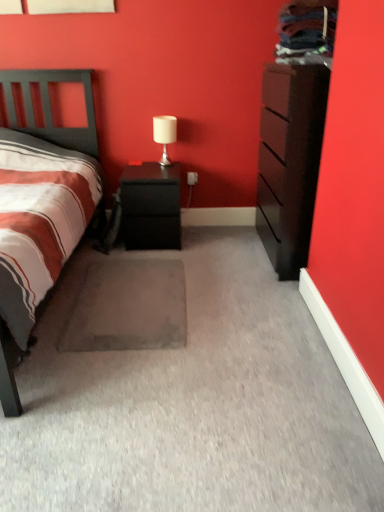
Question: Should I look upward or downward to see black matte nightstand at center?

Choices:
 (A) up
 (B) down

Answer: (A)

Question: From a real-world perspective, is black matte nightstand at center located beneath dark brown wood chest of drawers at right?

Choices:
 (A) yes
 (B) no

Answer: (A)

Question: Considering the relative sizes of black matte nightstand at center and dark brown wood chest of drawers at right in the image provided, is black matte nightstand at center bigger than dark brown wood chest of drawers at right?

Choices:
 (A) yes
 (B) no

Answer: (B)

Question: Is black matte nightstand at center looking in the opposite direction of dark brown wood chest of drawers at right?

Choices:
 (A) yes
 (B) no

Answer: (B)

Question: Is black matte nightstand at center in contact with dark brown wood chest of drawers at right?

Choices:
 (A) no
 (B) yes

Answer: (A)

Question: Is black matte nightstand at center oriented towards dark brown wood chest of drawers at right?

Choices:
 (A) yes
 (B) no

Answer: (B)

Question: Can you confirm if black matte nightstand at center is positioned to the left of dark brown wood chest of drawers at right?

Choices:
 (A) no
 (B) yes

Answer: (B)

Question: Does white matte table lamp at upper center have a larger size compared to dark brown wood chest of drawers at right?

Choices:
 (A) yes
 (B) no

Answer: (B)

Question: Is white matte table lamp at upper center closer to camera compared to dark brown wood chest of drawers at right?

Choices:
 (A) no
 (B) yes

Answer: (A)

Question: From a real-world perspective, is white matte table lamp at upper center located higher than dark brown wood chest of drawers at right?

Choices:
 (A) no
 (B) yes

Answer: (B)

Question: Does white matte table lamp at upper center contain dark brown wood chest of drawers at right?

Choices:
 (A) yes
 (B) no

Answer: (B)

Question: Can you confirm if white matte table lamp at upper center is shorter than dark brown wood chest of drawers at right?

Choices:
 (A) no
 (B) yes

Answer: (B)

Question: Can you confirm if white matte table lamp at upper center is smaller than dark brown wood chest of drawers at right?

Choices:
 (A) yes
 (B) no

Answer: (A)

Question: From a real-world perspective, is black matte nightstand at center on top of white matte table lamp at upper center?

Choices:
 (A) yes
 (B) no

Answer: (B)